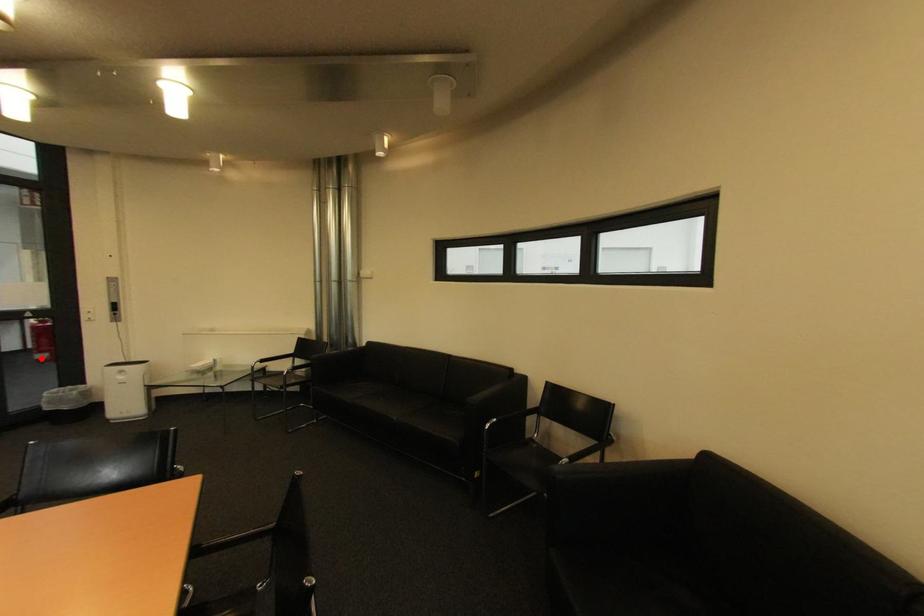
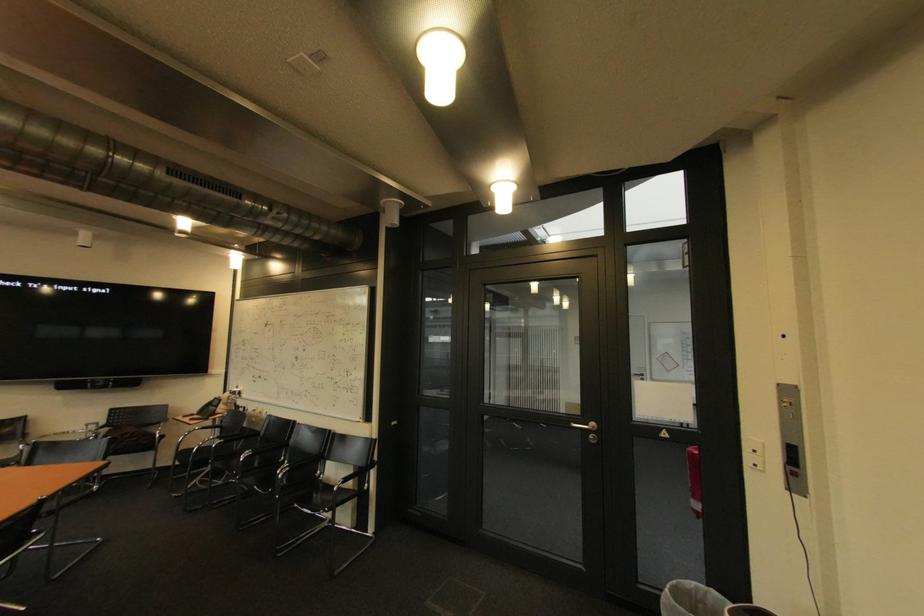
Locate, in the second image, the point that corresponds to the highlighted location in the first image.

(698, 501)